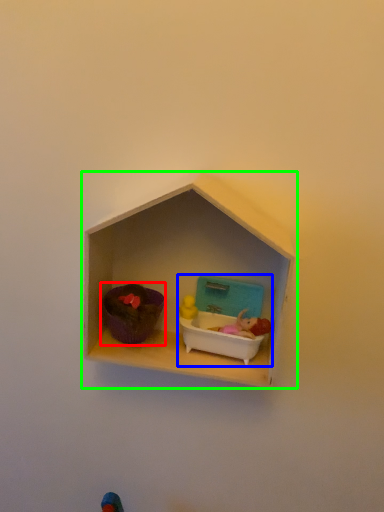
Question: Based on their relative distances, which object is nearer to toy (highlighted by a red box)? Choose from toy (highlighted by a blue box) and shelf (highlighted by a green box).

Choices:
 (A) toy
 (B) shelf

Answer: (A)